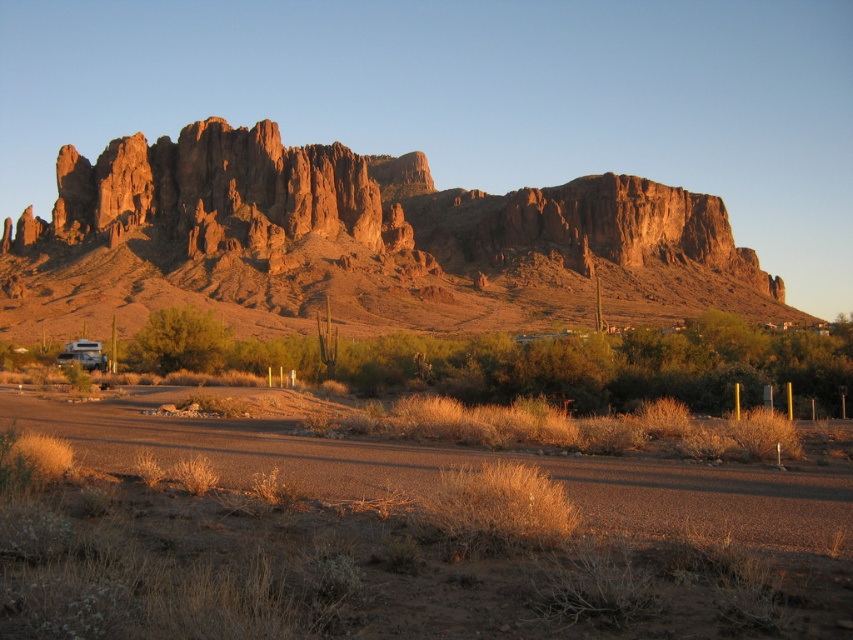
Is point (695, 580) positioned after point (88, 356)?

No, (695, 580) is in front of (88, 356).

Is dry grass at center positioned behind matte silver rv at lower left?

No, it is in front of matte silver rv at lower left.

Does point (775, 602) come in front of point (90, 365)?

Yes, it is.

Locate an element on the screen. This screenshot has width=853, height=640. dry grass at center is located at coordinates (399, 538).

Is dry grass at center bigger than rustic rock formation at upper center?

Actually, dry grass at center might be smaller than rustic rock formation at upper center.

Does dry grass at center appear under rustic rock formation at upper center?

Yes, dry grass at center is below rustic rock formation at upper center.

Where is `dry grass at center`? The height and width of the screenshot is (640, 853). dry grass at center is located at coordinates (399, 538).

Can you confirm if rustic rock formation at upper center is bigger than matte silver rv at lower left?

Correct, rustic rock formation at upper center is larger in size than matte silver rv at lower left.

Locate an element on the screen. rustic rock formation at upper center is located at coordinates (357, 243).

You are a GUI agent. You are given a task and a screenshot of the screen. Output one action in this format:
    pyautogui.click(x=<x>, y=<y>)
    Task: Click on the rustic rock formation at upper center
    Image resolution: width=853 pixels, height=640 pixels.
    Given the screenshot: What is the action you would take?
    357,243